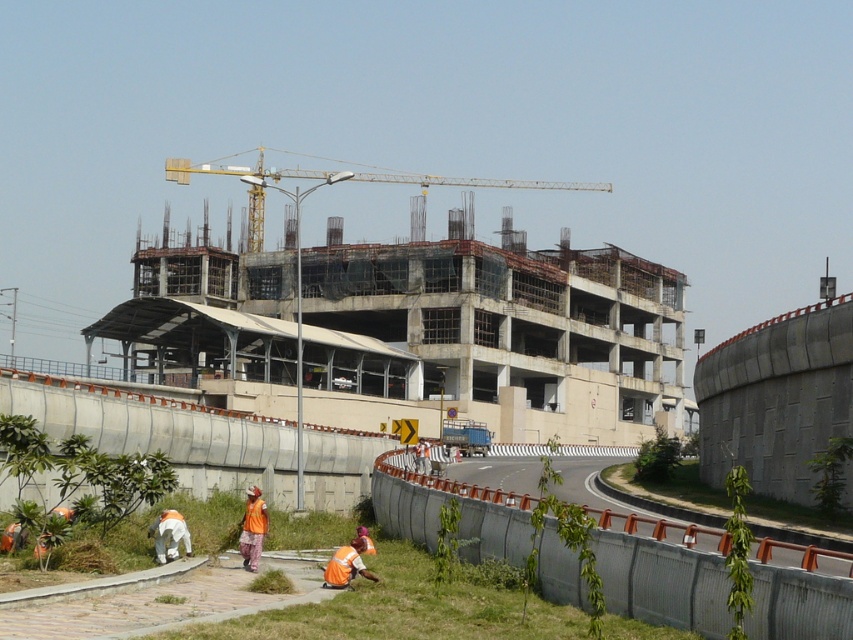
Which is behind, point (262, 536) or point (337, 573)?

The point (262, 536) is more distant.

Can you confirm if orange fabric at lower center is shorter than orange fabric worker at lower center?

In fact, orange fabric at lower center may be taller than orange fabric worker at lower center.

Is point (247, 518) in front of point (345, 552)?

No, (247, 518) is further to viewer.

Locate an element on the screen. This screenshot has height=640, width=853. orange fabric at lower center is located at coordinates (252, 529).

Based on the photo, does orange fabric worker at lower center have a lesser height compared to white fabric at lower left?

Yes.

Is orange fabric worker at lower center taller than white fabric at lower left?

Incorrect, orange fabric worker at lower center's height is not larger of white fabric at lower left's.

Locate an element on the screen. The height and width of the screenshot is (640, 853). orange fabric worker at lower center is located at coordinates (346, 564).

Is orange fabric at lower center thinner than white fabric at lower left?

In fact, orange fabric at lower center might be wider than white fabric at lower left.

Is orange fabric at lower center to the left of white fabric at lower left from the viewer's perspective?

Indeed, orange fabric at lower center is positioned on the left side of white fabric at lower left.

Does point (247, 557) lie behind point (173, 548)?

Yes, point (247, 557) is behind point (173, 548).

Identify the location of orange fabric at lower center. (252, 529).